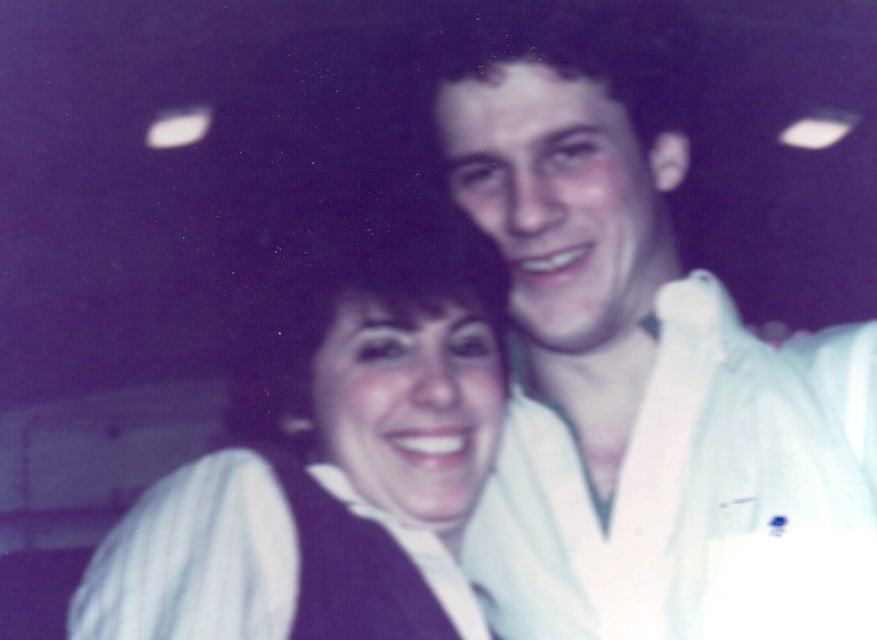
You are a photographer setting up for a photoshoot in a dimly lit room with bluish lighting. You have two props to place in the scene where the man and woman are standing. The props are the white cotton robe at upper right and the white striped fabric at center. According to the scene description, which prop should be placed closer to the camera to ensure both are visible in the photo?

The white cotton robe at upper right should be placed closer to the camera because the white striped fabric at center is behind it, so moving the robe forward ensures both are visible without one blocking the other.